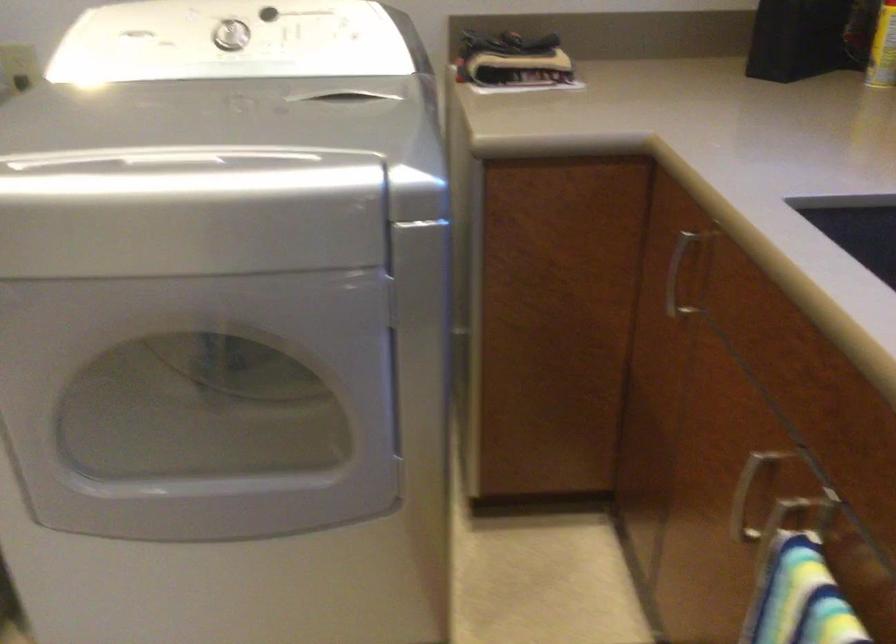
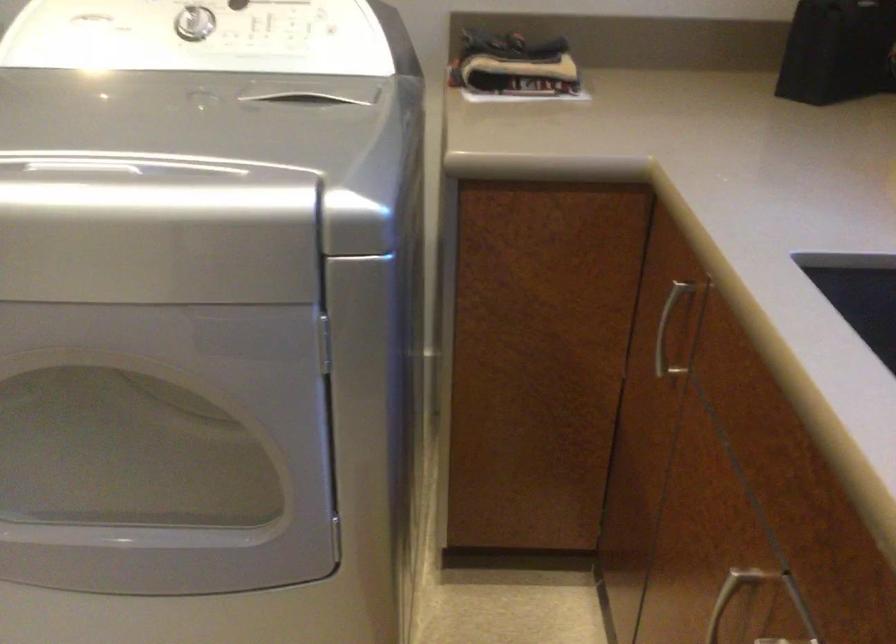
Question: The first image is from the beginning of the video and the second image is from the end. How did the camera likely rotate when shooting the video?

Choices:
 (A) Left
 (B) Right
 (C) Up
 (D) Down

Answer: (A)